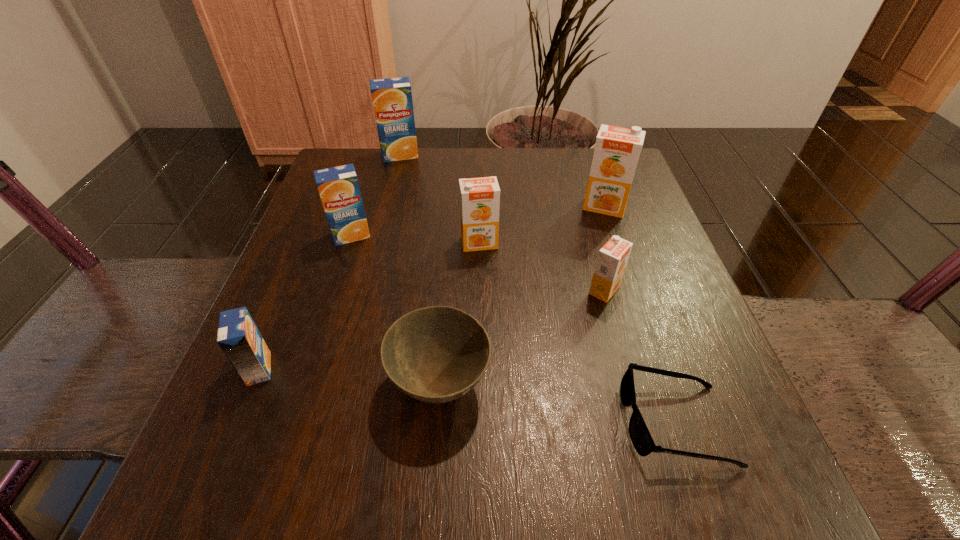
Find the location of a particular element. orange orange juice that is the closest one to the seventh nearest object is located at coordinates point(612,259).

Locate an element on the screen. orange orange juice that stands as the second closest to the leftmost orange orange juice is located at coordinates (617, 149).